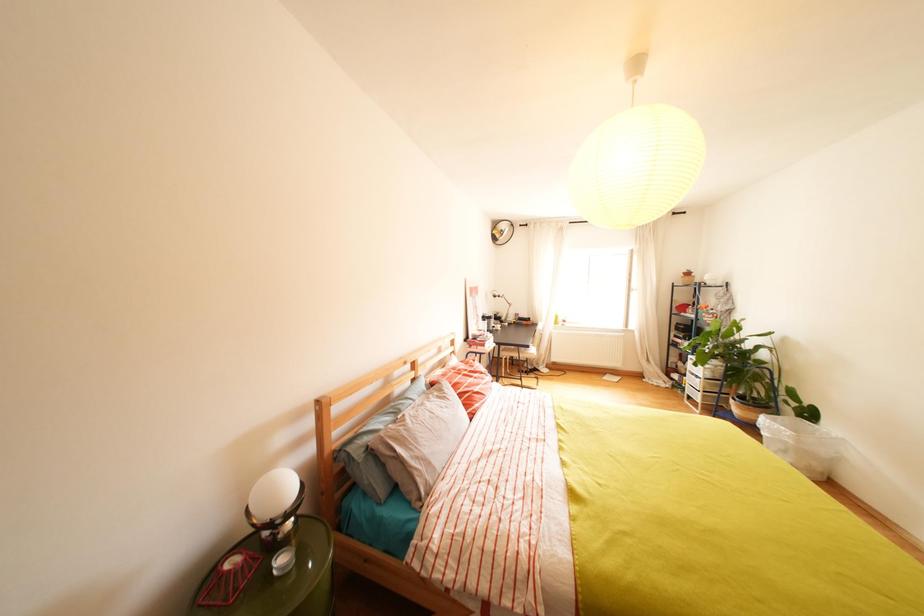
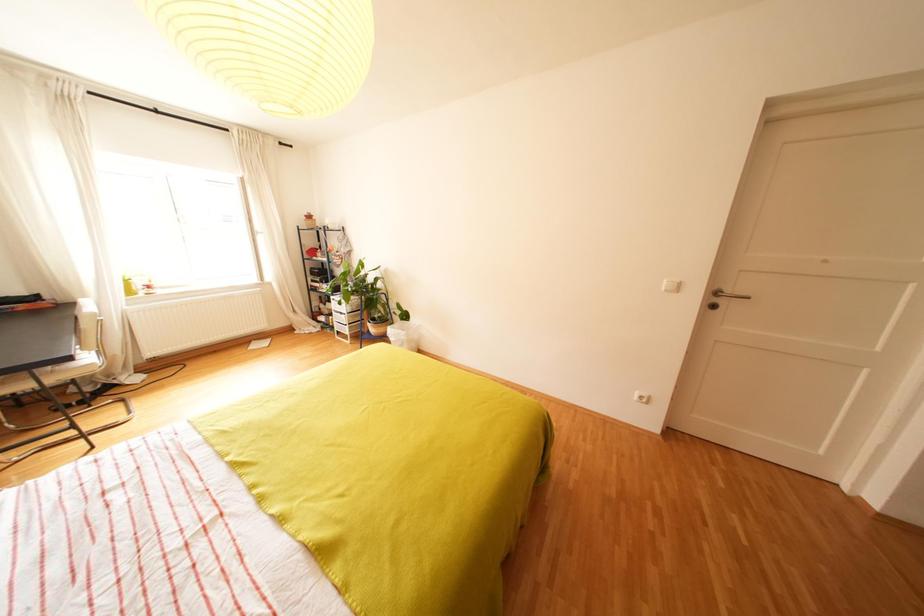
The first image is from the beginning of the video and the second image is from the end. How did the camera likely rotate when shooting the video?

The camera's rotation is toward right-down.